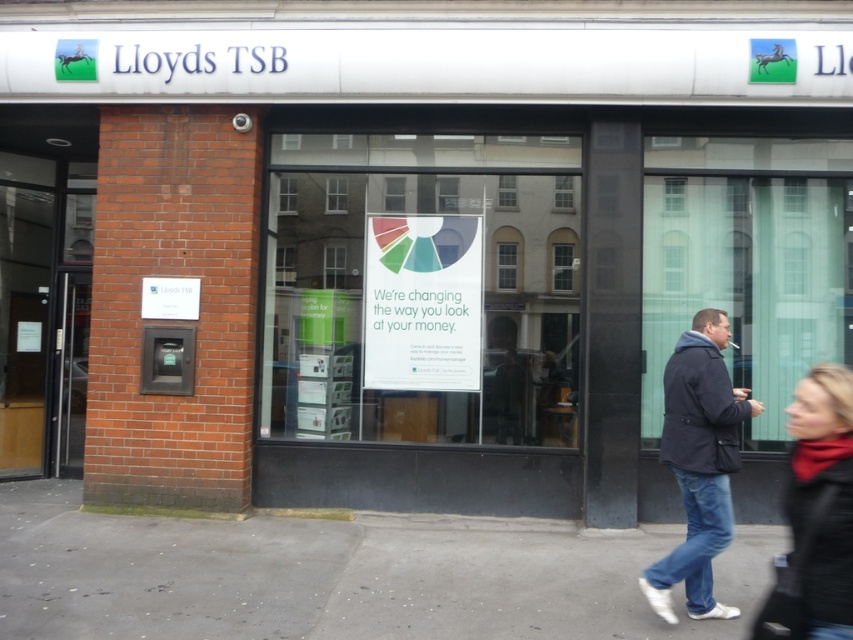
The image size is (853, 640). Describe the element at coordinates (341, 576) in the screenshot. I see `gray concrete pavement at lower center` at that location.

Identify the location of gray concrete pavement at lower center. (341, 576).

Can you confirm if dark blue jacket at right is positioned to the right of black leather jacket at lower right?

Indeed, dark blue jacket at right is positioned on the right side of black leather jacket at lower right.

Does dark blue jacket at right have a lesser width compared to black leather jacket at lower right?

No, dark blue jacket at right is not thinner than black leather jacket at lower right.

Measure the distance between dark blue jacket at right and camera.

dark blue jacket at right and camera are 4.88 meters apart from each other.

The image size is (853, 640). Find the location of `dark blue jacket at right`. dark blue jacket at right is located at coordinates (699, 464).

Does multicolored paper sign at center have a larger size compared to black leather jacket at lower right?

Incorrect, multicolored paper sign at center is not larger than black leather jacket at lower right.

Locate an element on the screen. The image size is (853, 640). multicolored paper sign at center is located at coordinates (422, 301).